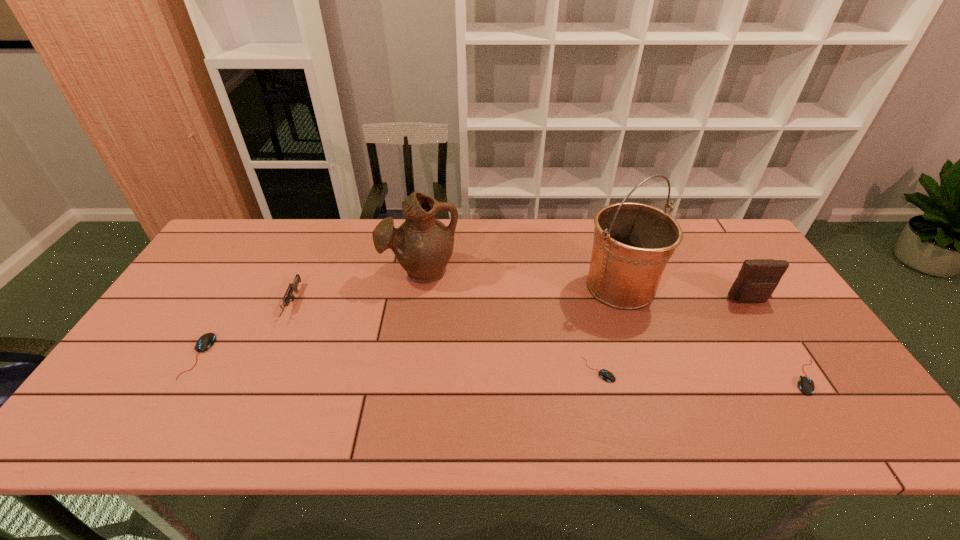
What are the coordinates of `unoccupied area between the third tallest object and the second shortest object` in the screenshot? It's located at (778, 339).

The image size is (960, 540). Identify the location of empty space that is in between the pitcher and the shortest mouse. (510, 321).

The width and height of the screenshot is (960, 540). What are the coordinates of `vacant area between the pouch and the tallest mouse` in the screenshot? It's located at (474, 328).

At what (x,y) coordinates should I click in order to perform the action: click on vacant area that lies between the bucket and the second shortest object. Please return your answer as a coordinate pair (x, y). The width and height of the screenshot is (960, 540). Looking at the image, I should click on (713, 332).

In order to click on blank region between the sixth shortest object and the bucket in this screenshot , I will do `click(520, 279)`.

Identify the location of free space between the bucket and the sixth shortest object. (520, 279).

The height and width of the screenshot is (540, 960). Find the location of `vacant point located between the fourth tallest object and the rightmost mouse`. vacant point located between the fourth tallest object and the rightmost mouse is located at coordinates coord(550,340).

Locate an element on the screen. free spot between the pitcher and the pouch is located at coordinates (585, 286).

Locate an element on the screen. free space between the second object from left to right and the shortest mouse is located at coordinates click(445, 336).

The height and width of the screenshot is (540, 960). I want to click on free spot between the leftmost object and the second shortest object, so click(503, 367).